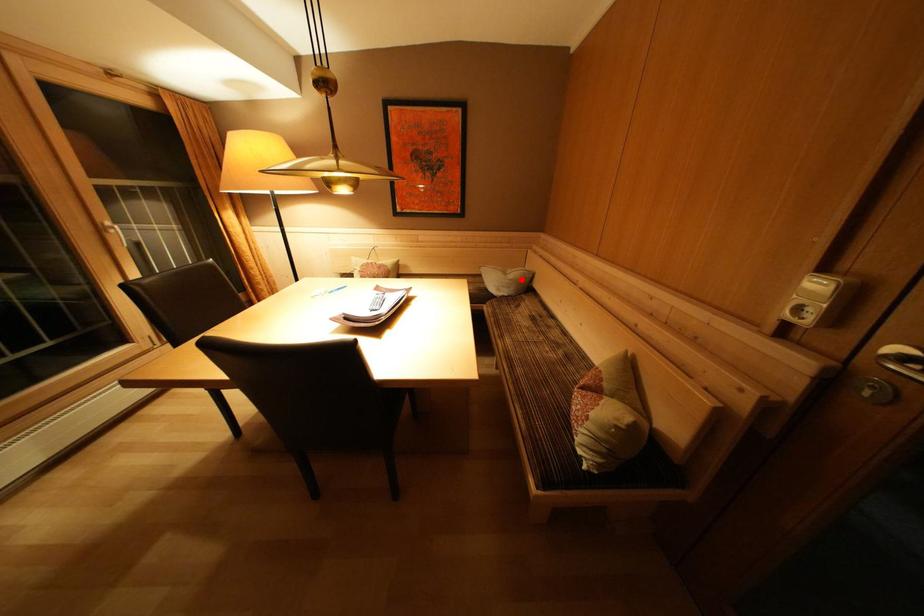
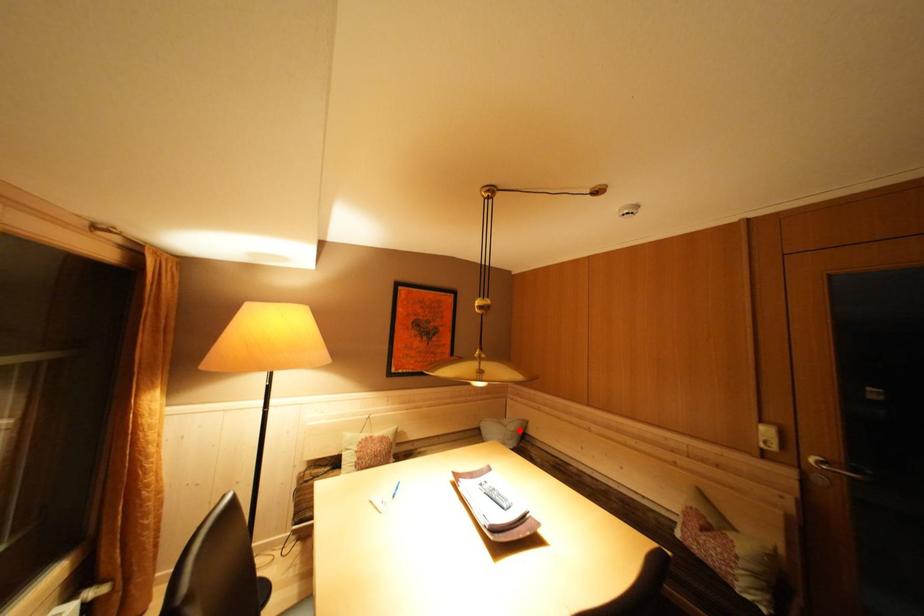
I am providing you with two images of the same scene from different viewpoints. A red point is marked on the first image and another point is marked on the second image. Does the point marked in image1 correspond to the same location as the one in image2?

Yes